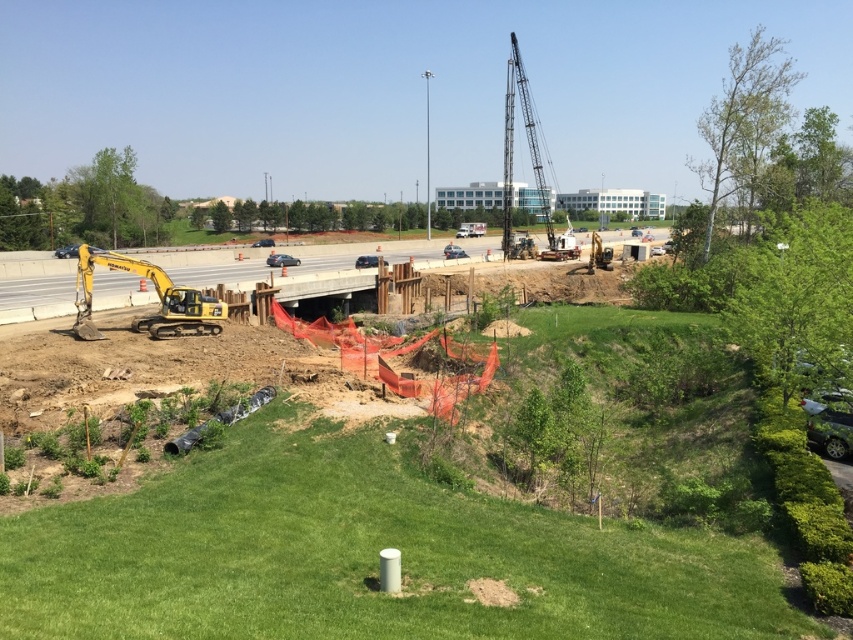
You are a construction worker standing at the edge of the construction site. You see the yellow excavator at lower left and the yellow metallic excavator at lower left. Which one is closer to you?

The yellow excavator at lower left is closer to you because the yellow metallic excavator at lower left is behind it.

You are a delivery driver who needs to navigate a truck through the construction site. You see the yellow excavator at lower left and the yellow metallic excavator at lower left. Which one has a larger width that could block the truck path?

The yellow excavator at lower left might be wider than yellow metallic excavator at lower left, so it could potentially block the truck path more than the other.